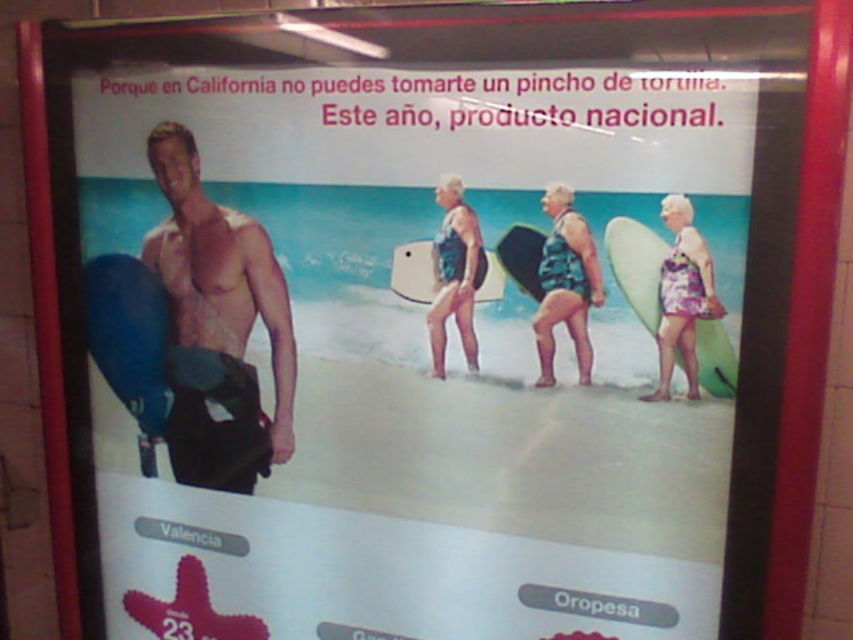
Is matte black shorts at left above camouflage-patterned surfboard at center?

No.

What do you see at coordinates (218, 324) in the screenshot?
I see `matte black shorts at left` at bounding box center [218, 324].

What are the coordinates of `matte black shorts at left` in the screenshot? It's located at (218, 324).

Which is more to the right, matte black shorts at left or blue fabric swimsuit at center?

Positioned to the right is blue fabric swimsuit at center.

Is matte black shorts at left bigger than blue fabric swimsuit at center?

Indeed, matte black shorts at left has a larger size compared to blue fabric swimsuit at center.

This screenshot has width=853, height=640. I want to click on matte black shorts at left, so click(x=218, y=324).

Find the location of `matte black shorts at left`. matte black shorts at left is located at coordinates (218, 324).

Which is in front, point (219, 339) or point (164, 410)?

Point (219, 339) is more forward.

Is matte black shorts at left above blue matte surfboard at left?

Yes.

Identify the location of matte black shorts at left. Image resolution: width=853 pixels, height=640 pixels. (218, 324).